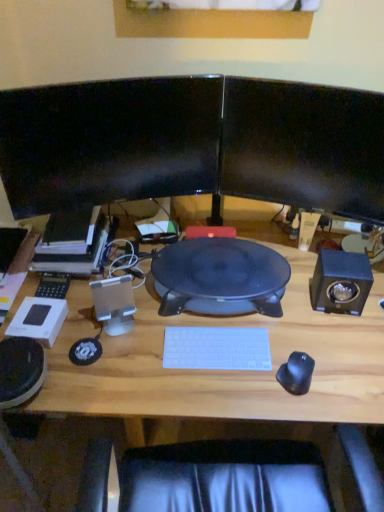
This screenshot has width=384, height=512. What are the coordinates of `vacant space that's between black rubberized mouse at right and satin black speaker at right, positioned as the second speaker in left-to-right order` in the screenshot? It's located at (317, 342).